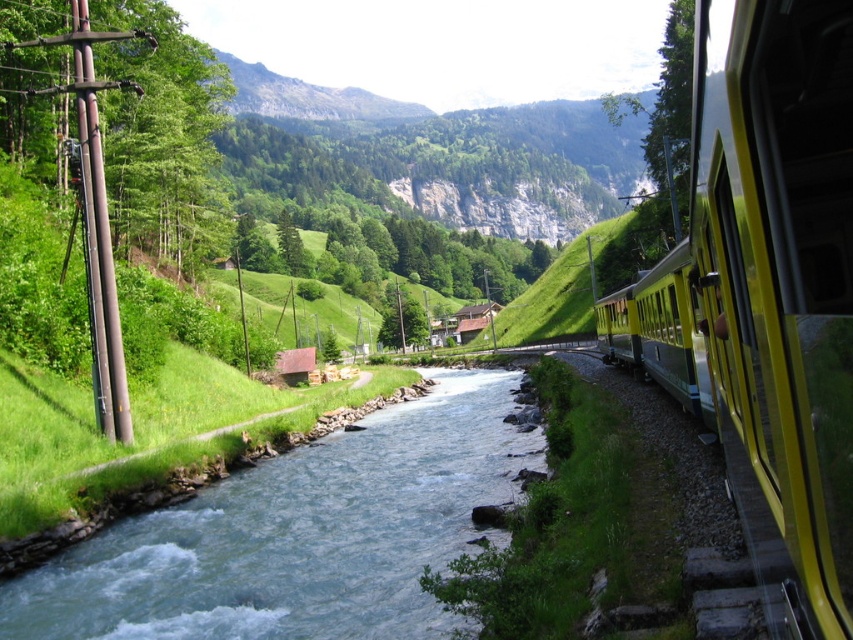
Question: Does yellow polished metal train at right have a greater width compared to blue smooth water at center?

Choices:
 (A) no
 (B) yes

Answer: (B)

Question: Which point is closer to the camera?

Choices:
 (A) (844, 212)
 (B) (451, 522)

Answer: (A)

Question: Does yellow polished metal train at right have a larger size compared to blue smooth water at center?

Choices:
 (A) no
 (B) yes

Answer: (B)

Question: Is yellow polished metal train at right further to camera compared to blue smooth water at center?

Choices:
 (A) yes
 (B) no

Answer: (B)

Question: Which point is farther to the camera?

Choices:
 (A) blue smooth water at center
 (B) yellow polished metal train at right

Answer: (A)